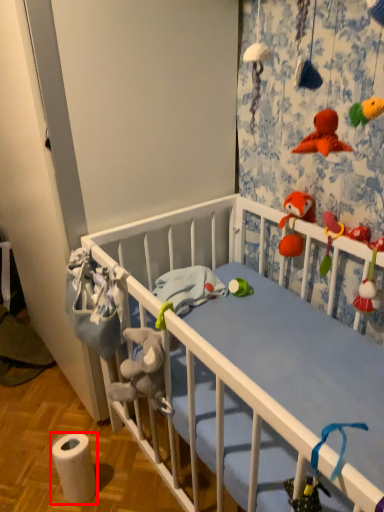
Question: In this image, where is toilet paper (annotated by the red box) located relative to toy?

Choices:
 (A) left
 (B) right

Answer: (A)